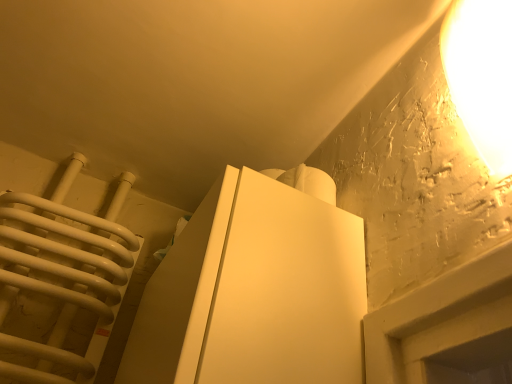
Question: Does white matte cabinet at center contain matte white lampshade at upper right?

Choices:
 (A) yes
 (B) no

Answer: (B)

Question: Is white matte cabinet at center at the left side of matte white lampshade at upper right?

Choices:
 (A) yes
 (B) no

Answer: (A)

Question: Is white matte cabinet at center smaller than matte white lampshade at upper right?

Choices:
 (A) no
 (B) yes

Answer: (A)

Question: Is white matte cabinet at center closer to camera compared to matte white lampshade at upper right?

Choices:
 (A) no
 (B) yes

Answer: (A)

Question: Is white matte cabinet at center aimed at matte white lampshade at upper right?

Choices:
 (A) no
 (B) yes

Answer: (A)

Question: From a real-world perspective, is white matte cabinet at center located higher than matte white lampshade at upper right?

Choices:
 (A) no
 (B) yes

Answer: (A)

Question: Is matte white lampshade at upper right behind white matte cabinet at center?

Choices:
 (A) no
 (B) yes

Answer: (A)

Question: Is matte white lampshade at upper right far from white matte cabinet at center?

Choices:
 (A) yes
 (B) no

Answer: (B)

Question: From the image's perspective, is matte white lampshade at upper right on top of white matte cabinet at center?

Choices:
 (A) no
 (B) yes

Answer: (B)

Question: Considering the relative sizes of matte white lampshade at upper right and white matte cabinet at center in the image provided, is matte white lampshade at upper right taller than white matte cabinet at center?

Choices:
 (A) yes
 (B) no

Answer: (A)

Question: Is matte white lampshade at upper right touching white matte cabinet at center?

Choices:
 (A) no
 (B) yes

Answer: (A)

Question: Can you confirm if matte white lampshade at upper right is wider than white matte cabinet at center?

Choices:
 (A) no
 (B) yes

Answer: (A)

Question: From the image's perspective, relative to matte white lampshade at upper right, is white matte cabinet at center above or below?

Choices:
 (A) below
 (B) above

Answer: (A)